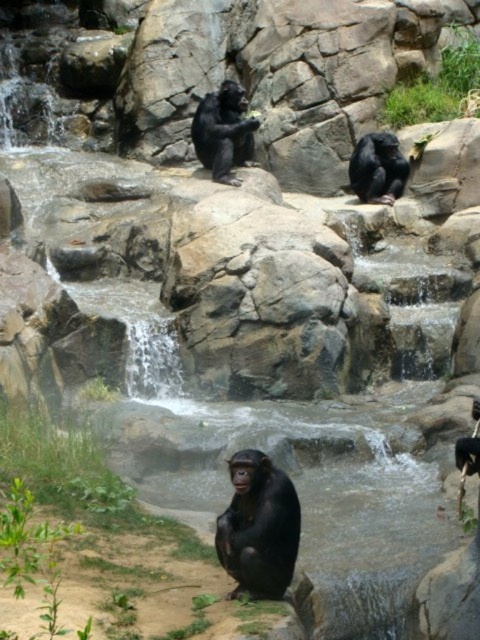
Question: Which object appears farthest from the camera in this image?

Choices:
 (A) shiny black monkey at upper center
 (B) shiny black monkey at center
 (C) black matte monkey at center

Answer: (A)

Question: Among these objects, which one is nearest to the camera?

Choices:
 (A) shiny black monkey at upper center
 (B) shiny black monkey at center
 (C) black matte monkey at center

Answer: (B)

Question: Is shiny black monkey at center above black matte monkey at center?

Choices:
 (A) no
 (B) yes

Answer: (A)

Question: Can you confirm if shiny black monkey at center is wider than shiny black monkey at upper center?

Choices:
 (A) yes
 (B) no

Answer: (B)

Question: Does black matte monkey at center have a greater width compared to shiny black monkey at upper center?

Choices:
 (A) yes
 (B) no

Answer: (A)

Question: Among these points, which one is nearest to the camera?

Choices:
 (A) (247, 557)
 (B) (356, 148)
 (C) (212, 147)

Answer: (A)